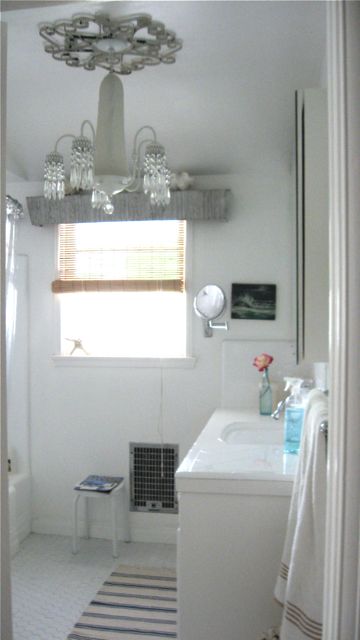
You are a GUI agent. You are given a task and a screenshot of the screen. Output one action in this format:
    pyautogui.click(x=<x>, y=<y>)
    Task: Click on the chandelier
    The height and width of the screenshot is (640, 360).
    Given the screenshot: What is the action you would take?
    pyautogui.click(x=82, y=161)